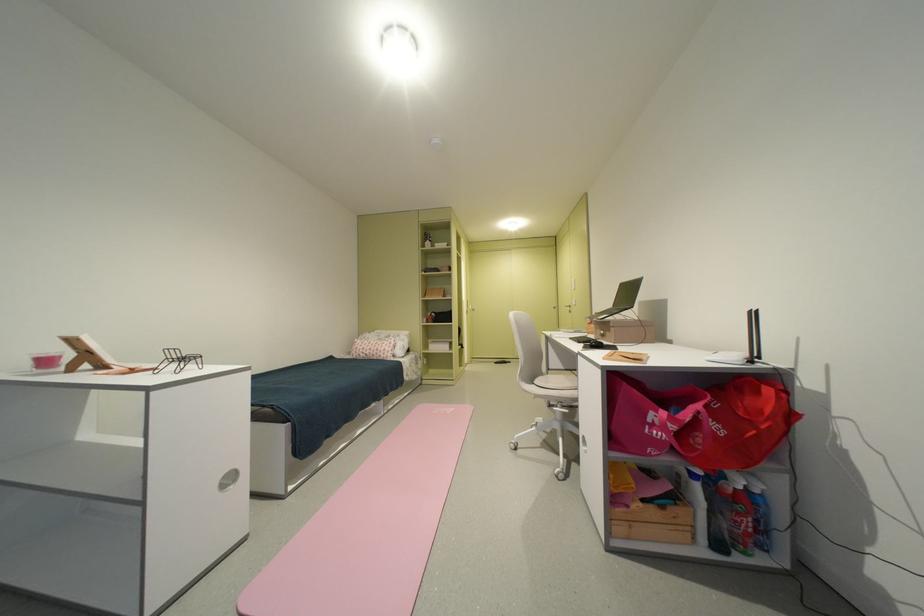
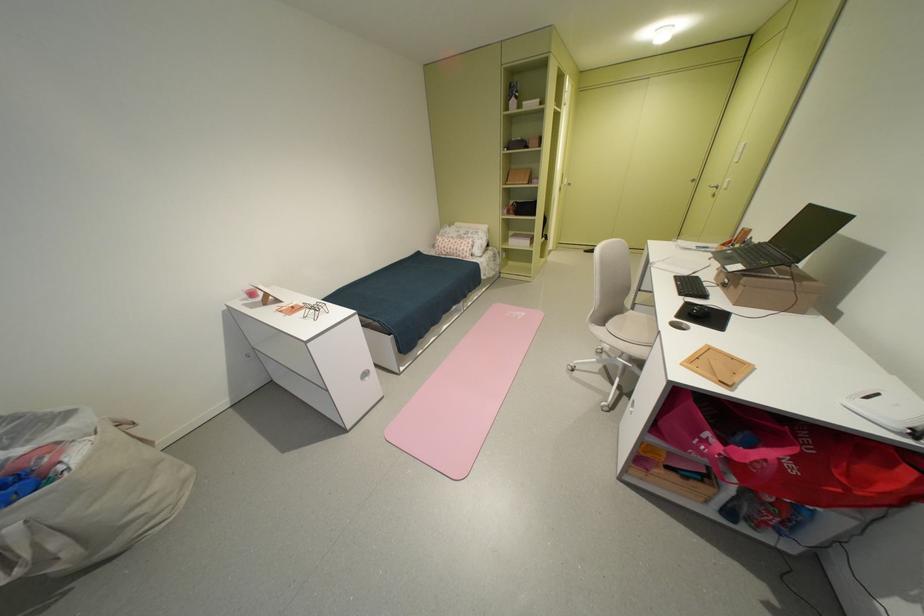
Find the pixel in the second image that matches [543,383] in the first image.

(615, 326)